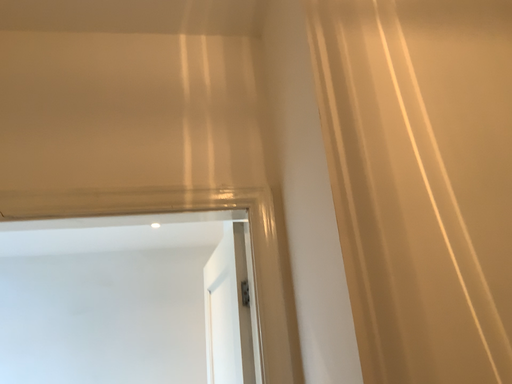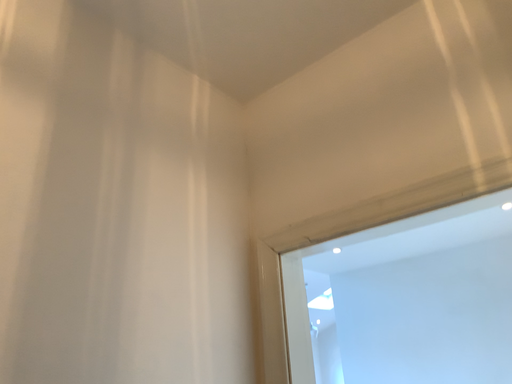
Question: How did the camera likely rotate when shooting the video?

Choices:
 (A) rotated upward
 (B) rotated downward

Answer: (B)